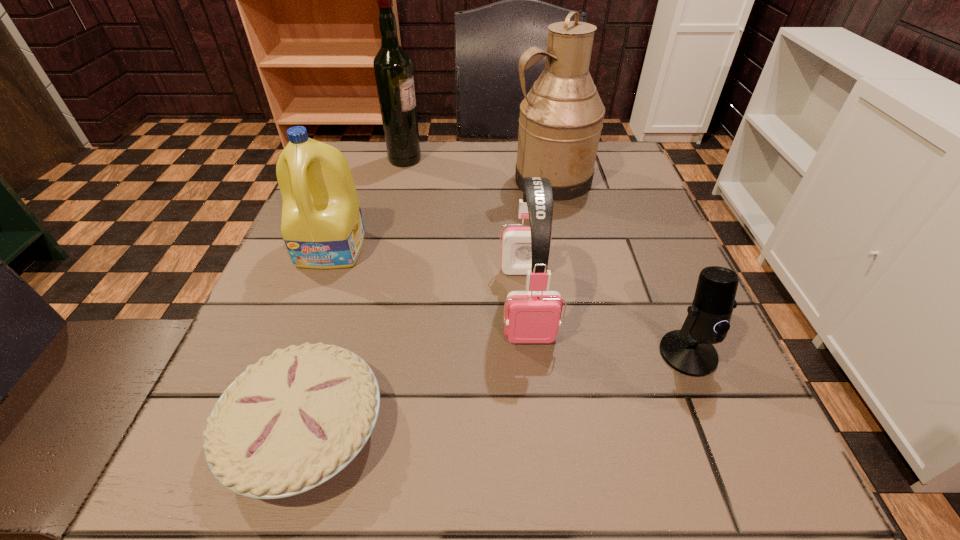
Locate an element on the screen. Image resolution: width=960 pixels, height=540 pixels. wine bottle is located at coordinates (393, 68).

Identify the location of pitcher. The width and height of the screenshot is (960, 540). coord(561,118).

Find the location of a particular element. Image resolution: width=960 pixels, height=540 pixels. detergent is located at coordinates (322, 226).

Locate an element on the screen. earphone is located at coordinates pos(533,316).

You are a GUI agent. You are given a task and a screenshot of the screen. Output one action in this format:
    pyautogui.click(x=<x>, y=<y>)
    Task: Click on the rightmost object
    This screenshot has width=960, height=540.
    Given the screenshot: What is the action you would take?
    pyautogui.click(x=689, y=351)

Image resolution: width=960 pixels, height=540 pixels. I want to click on microphone, so click(x=689, y=351).

Where is `the shortest object`? Image resolution: width=960 pixels, height=540 pixels. the shortest object is located at coordinates (290, 422).

Locate an element on the screen. vacant space located 0.150m on the front and back of the wine bottle is located at coordinates (482, 159).

I want to click on vacant space located 0.270m on the front of the pitcher, so click(575, 289).

In order to click on vacant space located on the label of the detergent in this screenshot , I will do `click(284, 380)`.